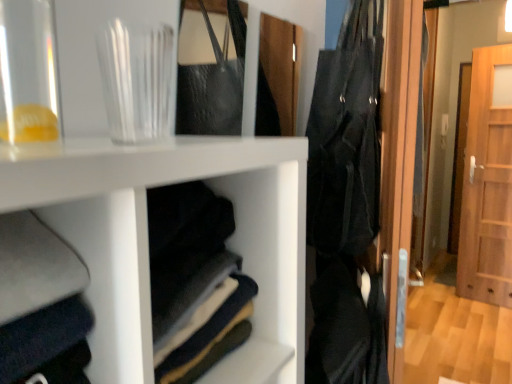
Question: From the image's perspective, is black fabric bag at right below transparent glass jar at upper left, which ranks as the 2th glass vase in back-to-front order?

Choices:
 (A) yes
 (B) no

Answer: (B)

Question: Does black fabric bag at right come behind transparent glass jar at upper left, the first glass vase in the left-to-right sequence?

Choices:
 (A) no
 (B) yes

Answer: (B)

Question: Can you confirm if black fabric bag at right is smaller than transparent glass jar at upper left, the 2th glass vase from the right?

Choices:
 (A) yes
 (B) no

Answer: (B)

Question: Does black fabric bag at right touch transparent glass jar at upper left, the 2th glass vase from the right?

Choices:
 (A) no
 (B) yes

Answer: (A)

Question: Considering the relative sizes of black fabric bag at right and transparent glass jar at upper left, the 2th glass vase from the right, in the image provided, is black fabric bag at right thinner than transparent glass jar at upper left, the 2th glass vase from the right,?

Choices:
 (A) yes
 (B) no

Answer: (B)

Question: Is transparent glass at upper left, which appears as the second glass vase when viewed from the front, wider or thinner than wooden door at right?

Choices:
 (A) wide
 (B) thin

Answer: (B)

Question: Choose the correct answer: Is transparent glass at upper left, arranged as the second glass vase when viewed from the left, inside wooden door at right or outside it?

Choices:
 (A) outside
 (B) inside

Answer: (A)

Question: Considering the positions of transparent glass at upper left, arranged as the second glass vase when viewed from the left, and wooden door at right in the image, is transparent glass at upper left, arranged as the second glass vase when viewed from the left, bigger or smaller than wooden door at right?

Choices:
 (A) big
 (B) small

Answer: (B)

Question: Considering the positions of point (137, 92) and point (488, 120), is point (137, 92) closer or farther from the camera than point (488, 120)?

Choices:
 (A) closer
 (B) farther

Answer: (A)

Question: In terms of size, does black fabric bag at right appear bigger or smaller than transparent glass jar at upper left, placed as the first glass vase when sorted from front to back?

Choices:
 (A) big
 (B) small

Answer: (A)

Question: In the image, is black fabric bag at right positioned in front of or behind transparent glass jar at upper left, the first glass vase in the left-to-right sequence?

Choices:
 (A) behind
 (B) front

Answer: (A)

Question: Is black fabric bag at right to the left or to the right of transparent glass jar at upper left, which ranks as the 2th glass vase in back-to-front order, in the image?

Choices:
 (A) left
 (B) right

Answer: (B)

Question: Considering the positions of black fabric bag at right and transparent glass jar at upper left, which ranks as the 2th glass vase in back-to-front order, in the image, is black fabric bag at right wider or thinner than transparent glass jar at upper left, which ranks as the 2th glass vase in back-to-front order,?

Choices:
 (A) wide
 (B) thin

Answer: (A)

Question: In terms of width, does wooden door at right look wider or thinner when compared to transparent glass jar at upper left, the 2th glass vase from the right?

Choices:
 (A) wide
 (B) thin

Answer: (A)

Question: Visually, is wooden door at right positioned to the left or to the right of transparent glass jar at upper left, the 2th glass vase from the right?

Choices:
 (A) right
 (B) left

Answer: (A)